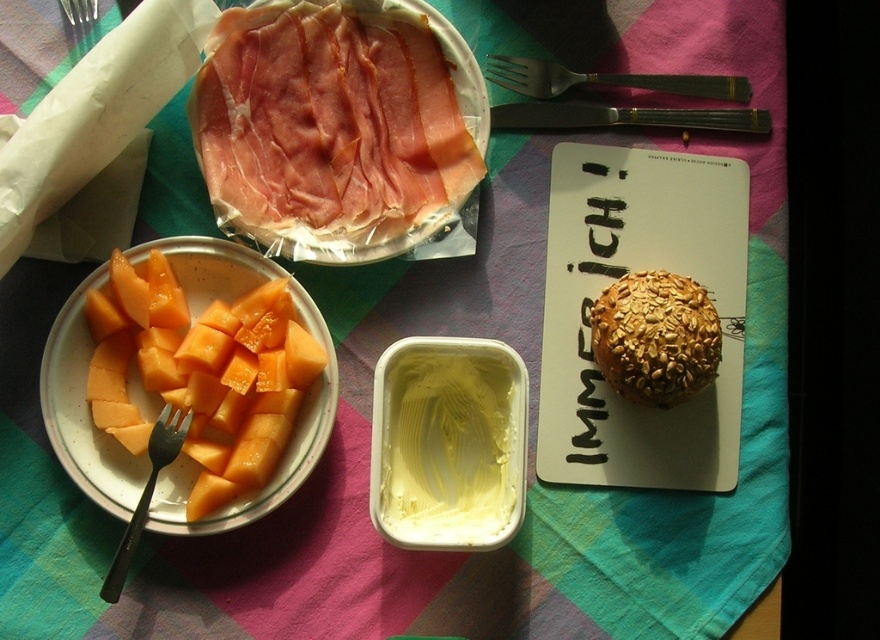
Question: Which of the following is the closest to the observer?

Choices:
 (A) (668, 380)
 (B) (370, 84)

Answer: (A)

Question: Which point is farther to the camera?

Choices:
 (A) (72, 8)
 (B) (504, 81)

Answer: (B)

Question: Among these points, which one is nearest to the camera?

Choices:
 (A) (70, 12)
 (B) (339, 64)
 (C) (209, 440)

Answer: (C)

Question: Can you confirm if pinkish-red cured meat at upper center is positioned to the left of silver metallic fork at upper center?

Choices:
 (A) yes
 (B) no

Answer: (A)

Question: Is silver metallic fork at upper center to the left of metallic silver fork at upper left from the viewer's perspective?

Choices:
 (A) yes
 (B) no

Answer: (B)

Question: Can you confirm if oatmeal-coated bagel at center-right is smaller than metallic silver fork at upper left?

Choices:
 (A) no
 (B) yes

Answer: (A)